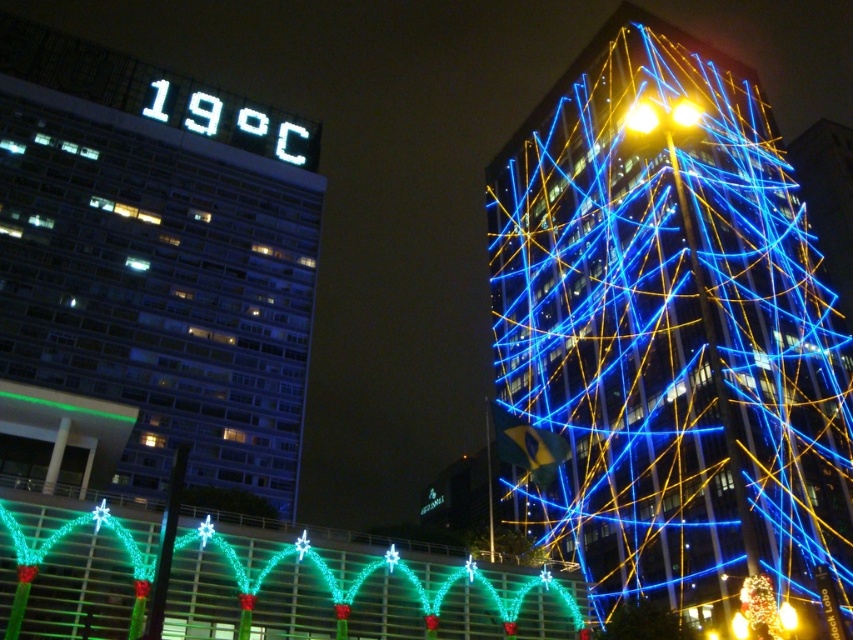
Question: Which point is farther from the camera taking this photo?

Choices:
 (A) pos(238,125)
 (B) pos(778,611)

Answer: (A)

Question: Is green glossy lights at center above yellow matte light at upper right?

Choices:
 (A) no
 (B) yes

Answer: (B)

Question: Based on their relative distances, which object is nearer to the yellow matte light at upper right?

Choices:
 (A) green glossy lights at center
 (B) green matte tree at center
 (C) blue wireframe structure at upper right
 (D) white digital sign at upper center

Answer: (A)

Question: Can you confirm if green matte tree at center is positioned to the right of yellow matte light at upper right?

Choices:
 (A) yes
 (B) no

Answer: (B)

Question: Among these objects, which one is nearest to the camera?

Choices:
 (A) yellow metallic light at upper right
 (B) illuminated wireframe tree at center
 (C) green glossy lights at center

Answer: (C)

Question: Is white digital sign at upper center below yellow metallic streetlight at upper right?

Choices:
 (A) yes
 (B) no

Answer: (A)